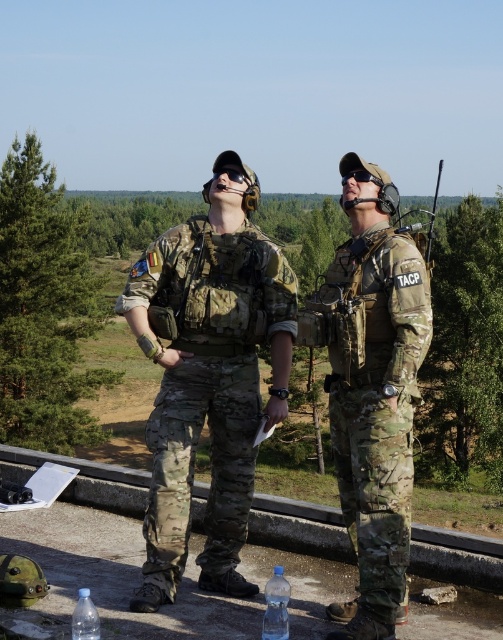
Question: Is clear plastic bottle at lower center to the left of transparent plastic bottle at lower left from the viewer's perspective?

Choices:
 (A) no
 (B) yes

Answer: (A)

Question: Which point is farther to the camera?

Choices:
 (A) (358, 180)
 (B) (179, 490)

Answer: (B)

Question: Which of the following is the closest to the observer?

Choices:
 (A) camouflage uniform at center
 (B) black matte goggles at upper center

Answer: (B)

Question: Does camouflage uniform at center come behind transparent plastic bottle at lower left?

Choices:
 (A) no
 (B) yes

Answer: (B)

Question: Does camouflage uniform at center appear on the left side of clear plastic bottle at lower center?

Choices:
 (A) no
 (B) yes

Answer: (B)

Question: Which point is farther to the camera?

Choices:
 (A) clear plastic bottle at lower center
 (B) camouflage uniform at center
 (C) camouflage fabric uniform at center
 (D) transparent plastic bottle at lower left

Answer: (B)